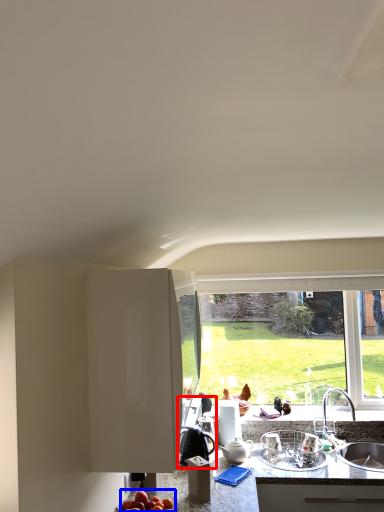
Question: Which object appears farthest to the camera in this image, appliance (highlighted by a red box) or apple (highlighted by a blue box)?

Choices:
 (A) appliance
 (B) apple

Answer: (A)